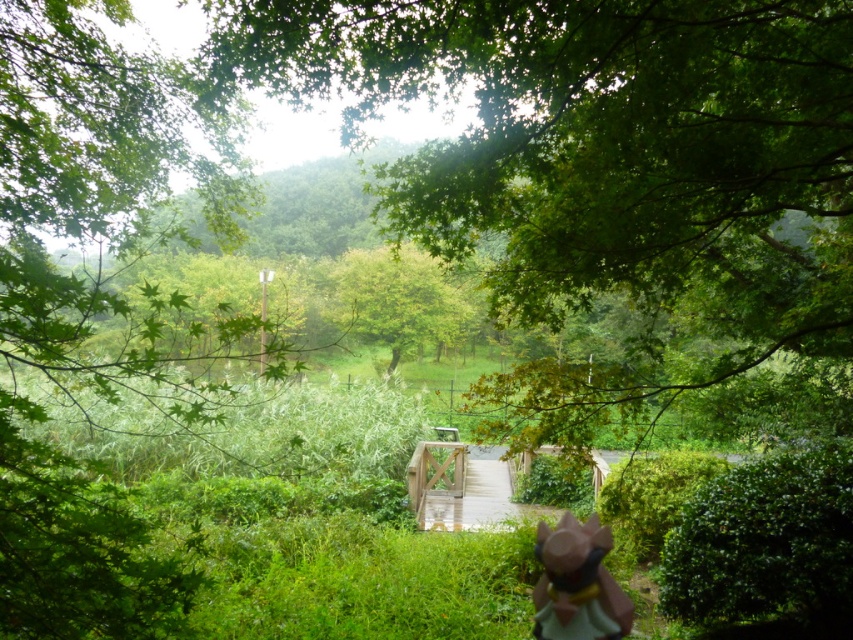
You are an explorer navigating through the serene natural scene. You notice the green leafy tree at center and the pink matte figurine at lower center. Which object occupies more horizontal space in the image?

The green leafy tree at center occupies more horizontal space in the image than the pink matte figurine at lower center because its width surpasses the figurine.